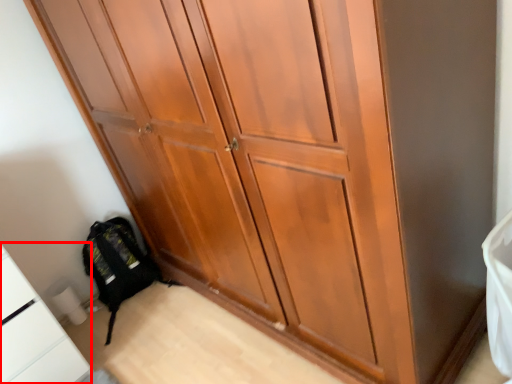
Question: From the image's perspective, what is the correct spatial positioning of cabinetry (annotated by the red box) in reference to backpack?

Choices:
 (A) above
 (B) below

Answer: (B)